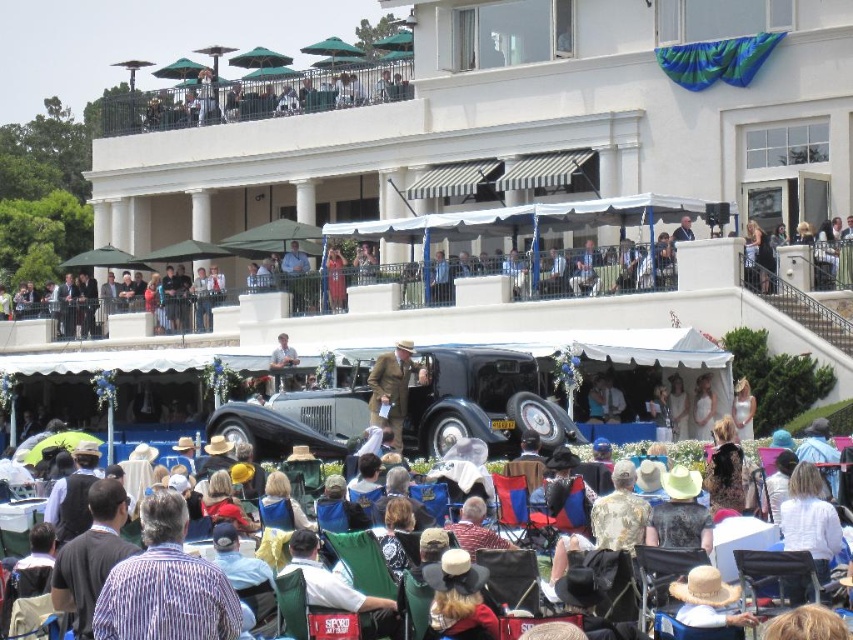
You are attending this event and want to take a photo of the striped cotton shirt at center and the metallic silver chair at center. Which object is closer to the ground?

The striped cotton shirt at center is shorter than the metallic silver chair at center, so the striped cotton shirt at center is closer to the ground.

You are attending an outdoor event and notice two people in the crowd. One is wearing a striped cotton shirt at lower left and the other is wearing a brown wool coat at center. From your perspective, which person is positioned lower in the scene?

The striped cotton shirt at lower left is positioned lower than the brown wool coat at center in the scene.